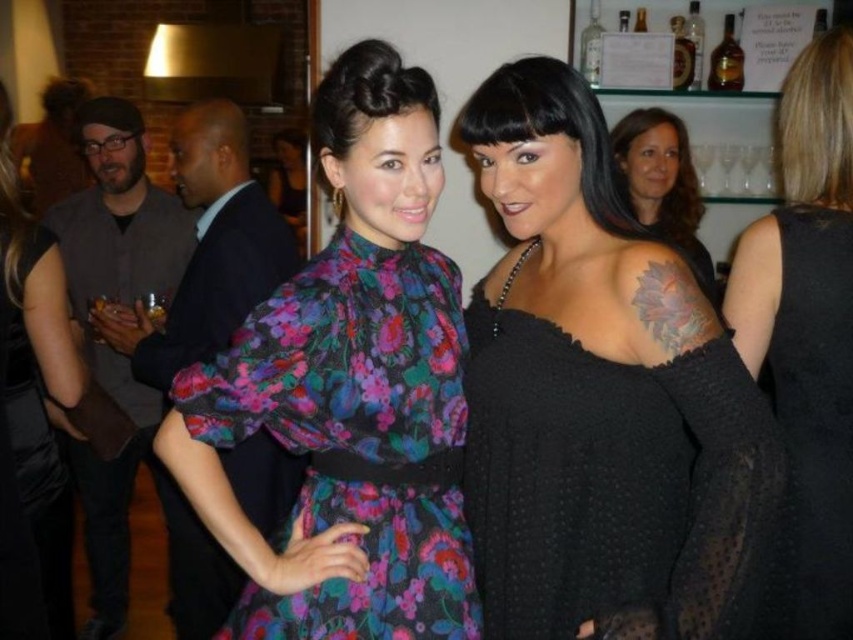
Does dark gray textured sweater at upper right have a greater height compared to amber glass bottle at upper right?

Yes.

Is point (613, 154) in front of point (714, 84)?

Yes.

Between point (660, 131) and point (730, 60), which one is positioned in front?

Point (660, 131)

Identify the location of dark gray textured sweater at upper right. click(x=662, y=182).

Is black dotted sweater at upper center below floral-patterned fabric dress at center?

Yes.

Can you confirm if black dotted sweater at upper center is shorter than floral-patterned fabric dress at center?

Yes.

The width and height of the screenshot is (853, 640). Describe the element at coordinates (616, 486) in the screenshot. I see `black dotted sweater at upper center` at that location.

Image resolution: width=853 pixels, height=640 pixels. I want to click on black dotted sweater at upper center, so click(x=616, y=486).

Is black dotted dress at upper right above floral print fabric dress at center?

Correct, black dotted dress at upper right is located above floral print fabric dress at center.

Image resolution: width=853 pixels, height=640 pixels. Describe the element at coordinates (808, 324) in the screenshot. I see `black dotted dress at upper right` at that location.

Where is `black dotted dress at upper right`? black dotted dress at upper right is located at coordinates (808, 324).